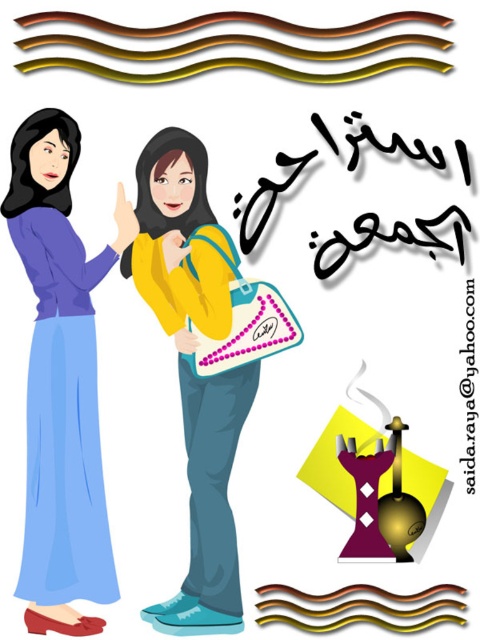
Based on the photo, please answer based on the scene description. Is the point at coordinate (x=59, y=387) part of the matte purple dress at left?

Yes, the point at coordinate (x=59, y=387) is part of the matte purple dress at left.